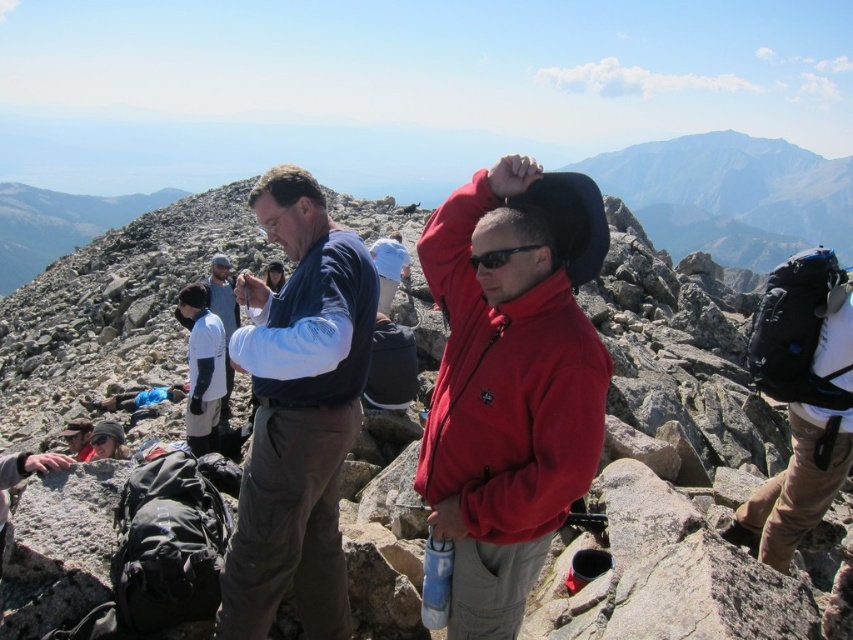
Question: Does blue fleece jacket at center have a lesser width compared to white cotton shirt at center?

Choices:
 (A) yes
 (B) no

Answer: (A)

Question: Among these points, which one is nearest to the camera?

Choices:
 (A) (503, 346)
 (B) (228, 356)
 (C) (277, 598)

Answer: (C)

Question: Which point is farther from the camera taking this photo?

Choices:
 (A) (403, 460)
 (B) (515, 387)

Answer: (A)

Question: Observing the image, what is the correct spatial positioning of rugged stone mountain at center in reference to red fleece jacket at center?

Choices:
 (A) below
 (B) above

Answer: (B)

Question: Does blue fleece jacket at center appear on the left side of red fleece jacket at center?

Choices:
 (A) no
 (B) yes

Answer: (B)

Question: Which point is farther from the camera taking this photo?

Choices:
 (A) (273, 220)
 (B) (448, 234)

Answer: (A)